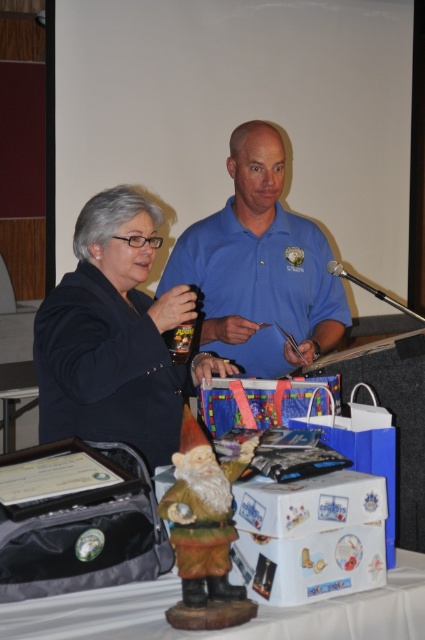
You are an event photographer positioned behind the table. You need to capture a clear photo of both the matte black jacket at center and the blue cotton shirt at center. Which one will appear larger in the photo?

The matte black jacket at center will appear larger in the photo because it is closer to the viewer than the blue cotton shirt at center.

You are a photographer standing behind the table at the event. You need to capture a photo of both the matte black jacket at center and the blue cotton shirt at center in the same frame. Given that your camera has a minimum focus distance of 24 inches, will you be able to focus on both subjects clearly?

The distance between the matte black jacket at center and the blue cotton shirt at center is 23.48 inches, which is less than the camera minimum focus distance of 24 inches. Therefore, the camera can focus on both subjects clearly.

You are a photographer at the event. You need to capture a photo of the polished wood gnome at center without the blue cotton shirt at center appearing in the foreground. Is this possible given their positions?

The blue cotton shirt at center is located above the polished wood gnome at center, so it is blocking the gnome. To avoid the shirt in the photo, you would need to adjust your angle or position to shoot from below the shirt or move the shirt temporarily.